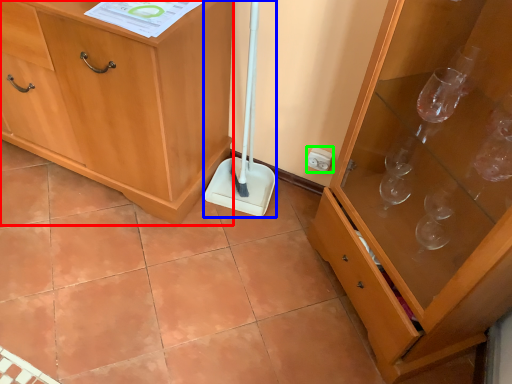
Question: Which object is positioned farthest from cabinetry (highlighted by a red box)? Select from shovel (highlighted by a blue box) and electric outlet (highlighted by a green box).

Choices:
 (A) shovel
 (B) electric outlet

Answer: (B)